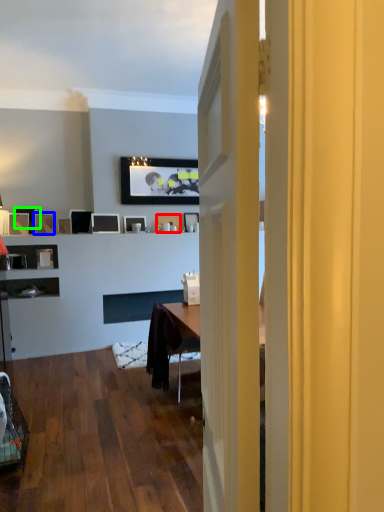
Question: Which is farther away from picture frame (highlighted by a red box)? picture frame (highlighted by a blue box) or picture frame (highlighted by a green box)?

Choices:
 (A) picture frame
 (B) picture frame

Answer: (B)